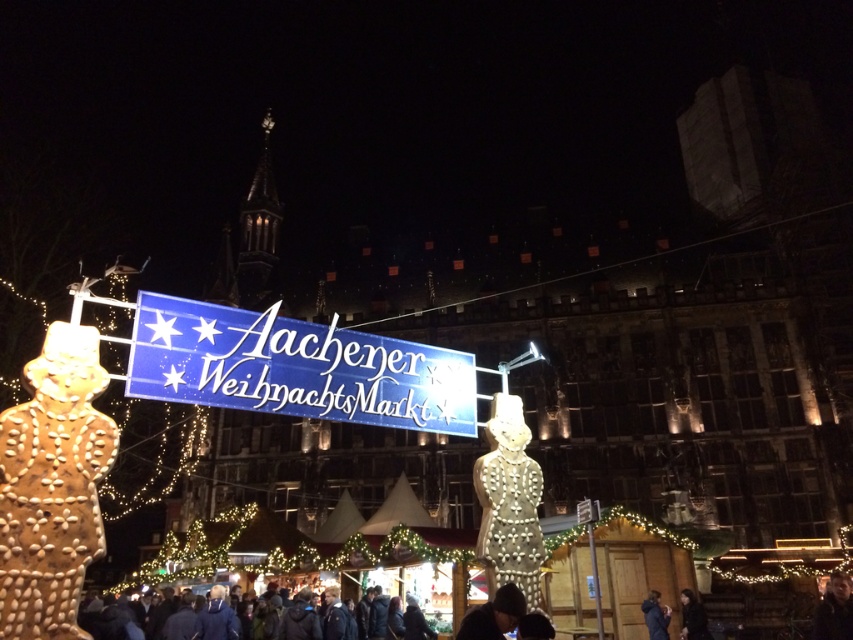
The width and height of the screenshot is (853, 640). I want to click on blue glossy sign at center, so click(294, 368).

Does blue glossy sign at center have a larger size compared to dark blue jacket at lower center?

Correct, blue glossy sign at center is larger in size than dark blue jacket at lower center.

Between point (283, 323) and point (689, 621), which one is positioned in front?

Positioned in front is point (283, 323).

Where is `blue glossy sign at center`? The height and width of the screenshot is (640, 853). blue glossy sign at center is located at coordinates (294, 368).

Is illuminated gingerbread man at left shorter than dark blue knit hat at lower center?

In fact, illuminated gingerbread man at left may be taller than dark blue knit hat at lower center.

The image size is (853, 640). I want to click on illuminated gingerbread man at left, so click(51, 486).

Does illuminated gingerbread man at left appear on the left side of dark blue jacket at lower right?

Indeed, illuminated gingerbread man at left is positioned on the left side of dark blue jacket at lower right.

Does illuminated gingerbread man at left have a larger size compared to dark blue jacket at lower right?

Yes.

This screenshot has height=640, width=853. What do you see at coordinates (51, 486) in the screenshot?
I see `illuminated gingerbread man at left` at bounding box center [51, 486].

The width and height of the screenshot is (853, 640). Identify the location of illuminated gingerbread man at left. (51, 486).